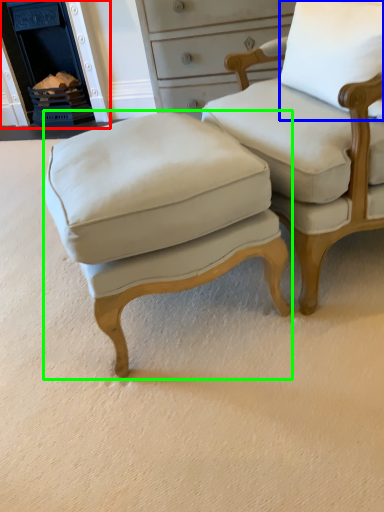
Question: Which object is the farthest from fireplace (highlighted by a red box)? Choose among these: pillow (highlighted by a blue box) or stool (highlighted by a green box).

Choices:
 (A) pillow
 (B) stool

Answer: (A)